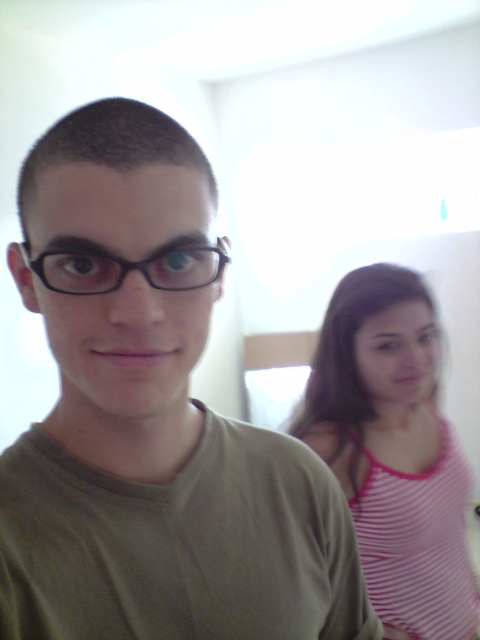
You are trying to determine the relative sizes of the objects in the scene. Based on the image, which object is bigger between the pink striped tank top at right and the black plastic glasses at center?

The pink striped tank top at right is larger in size than the black plastic glasses at center.

You are standing in the room and want to point to the location marked by the coordinates point (394, 449). Which object in the scene does this point correspond to?

The point (394, 449) is on the pink striped tank top at right.

You are trying to decide which item to pick up first between the matte green shirt at center and the black plastic glasses at center. Which one is larger?

The matte green shirt at center is bigger than the black plastic glasses at center, so you should pick up the matte green shirt at center first.